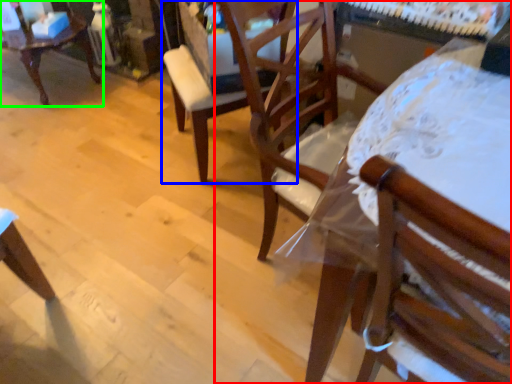
Question: Estimate the real-world distances between objects in this image. Which object is closer to chair (highlighted by a red box), chair (highlighted by a blue box) or chair (highlighted by a green box)?

Choices:
 (A) chair
 (B) chair

Answer: (A)